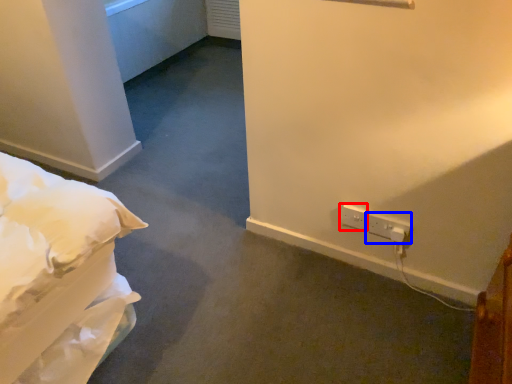
Question: Which of the following is the closest to the observer, electric outlet (highlighted by a red box) or electric outlet (highlighted by a blue box)?

Choices:
 (A) electric outlet
 (B) electric outlet

Answer: (B)